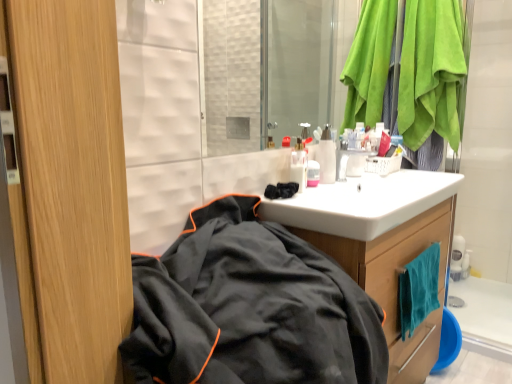
Question: Does black fabric jacket at lower left have a lesser height compared to wooden cabinet at center?

Choices:
 (A) no
 (B) yes

Answer: (B)

Question: From a real-world perspective, is black fabric jacket at lower left physically below wooden cabinet at center?

Choices:
 (A) yes
 (B) no

Answer: (B)

Question: Is black fabric jacket at lower left positioned beyond the bounds of wooden cabinet at center?

Choices:
 (A) yes
 (B) no

Answer: (A)

Question: Considering the relative sizes of black fabric jacket at lower left and wooden cabinet at center in the image provided, is black fabric jacket at lower left wider than wooden cabinet at center?

Choices:
 (A) no
 (B) yes

Answer: (B)

Question: Considering the relative sizes of black fabric jacket at lower left and wooden cabinet at center in the image provided, is black fabric jacket at lower left bigger than wooden cabinet at center?

Choices:
 (A) no
 (B) yes

Answer: (A)

Question: Can you confirm if black fabric jacket at lower left is thinner than wooden cabinet at center?

Choices:
 (A) no
 (B) yes

Answer: (A)

Question: Can you confirm if wooden cabinet at center is positioned to the right of green suede towel at upper right?

Choices:
 (A) no
 (B) yes

Answer: (A)

Question: Considering the relative sizes of wooden cabinet at center and green suede towel at upper right in the image provided, is wooden cabinet at center wider than green suede towel at upper right?

Choices:
 (A) yes
 (B) no

Answer: (A)

Question: Is wooden cabinet at center outside green suede towel at upper right?

Choices:
 (A) yes
 (B) no

Answer: (A)

Question: Can you confirm if wooden cabinet at center is shorter than green suede towel at upper right?

Choices:
 (A) no
 (B) yes

Answer: (A)

Question: Is wooden cabinet at center turned away from green suede towel at upper right?

Choices:
 (A) no
 (B) yes

Answer: (A)

Question: Is wooden cabinet at center further to the viewer compared to green suede towel at upper right?

Choices:
 (A) yes
 (B) no

Answer: (B)

Question: Does white glossy sink at center appear on the left side of pink glossy container at center, marked as the first toiletry in a right-to-left arrangement?

Choices:
 (A) no
 (B) yes

Answer: (A)